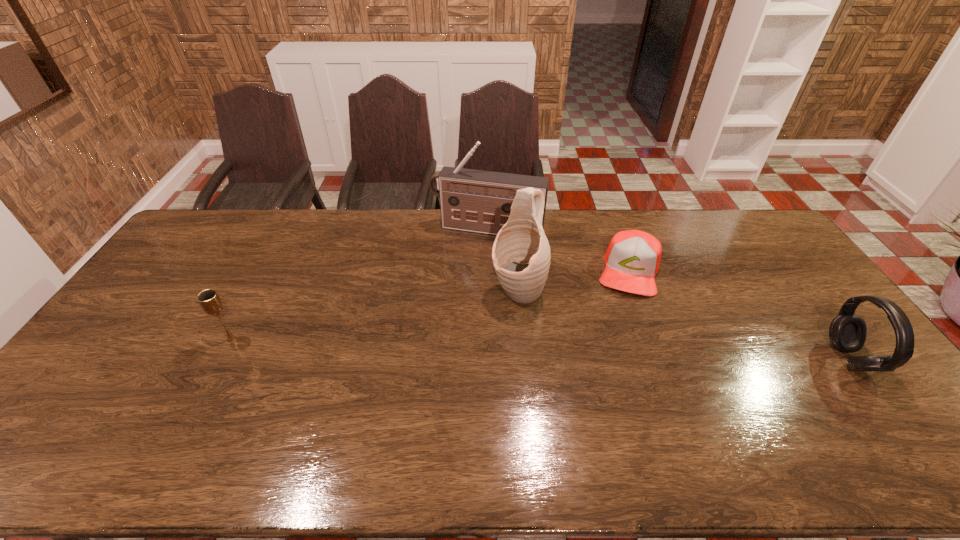
Locate an element on the screen. This screenshot has width=960, height=540. vacant space located at the spout of the pitcher is located at coordinates (438, 408).

Find the location of a particular element. The image size is (960, 540). vacant space located 0.310m at the spout of the pitcher is located at coordinates (x=453, y=387).

This screenshot has width=960, height=540. What are the coordinates of `free space located at the spout of the pitcher` in the screenshot? It's located at (436, 411).

Locate an element on the screen. This screenshot has width=960, height=540. free point located on the front panel of the farthest object is located at coordinates (458, 292).

Locate an element on the screen. The image size is (960, 540). vacant space located on the front panel of the farthest object is located at coordinates (450, 313).

Where is `vacant position located on the front panel of the farthest object`? This screenshot has width=960, height=540. vacant position located on the front panel of the farthest object is located at coordinates (471, 253).

Where is `baseball cap at the far edge`? The width and height of the screenshot is (960, 540). baseball cap at the far edge is located at coordinates (632, 260).

Locate an element on the screen. radio receiver that is at the far edge is located at coordinates (479, 201).

You are a GUI agent. You are given a task and a screenshot of the screen. Output one action in this format:
    pyautogui.click(x=<x>, y=<y>)
    Task: Click on the object that is positioned at the right edge
    
    Given the screenshot: What is the action you would take?
    pyautogui.click(x=847, y=332)

Locate an element on the screen. vacant space at the far edge of the desktop is located at coordinates (564, 211).